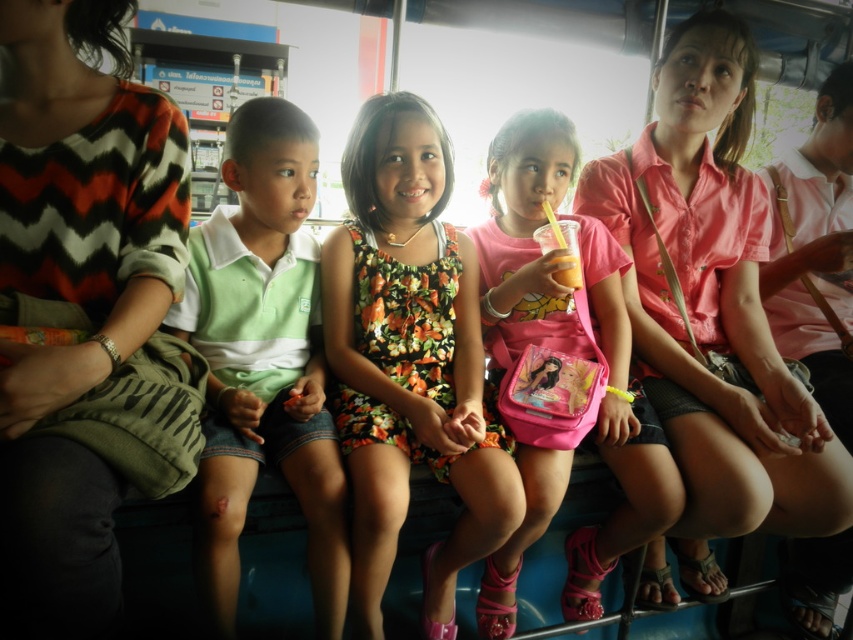
Is floral dress at center above green cotton shirt at left?

Yes, floral dress at center is above green cotton shirt at left.

Describe the element at coordinates (409, 358) in the screenshot. I see `floral dress at center` at that location.

Locate an element on the screen. floral dress at center is located at coordinates (409, 358).

Does floral dress at center have a larger size compared to pink fabric bag at center?

No.

Based on the photo, how far apart are floral dress at center and pink fabric bag at center?

floral dress at center is 20.57 centimeters away from pink fabric bag at center.

This screenshot has width=853, height=640. I want to click on floral dress at center, so click(x=409, y=358).

At what (x,y) coordinates should I click in order to perform the action: click on floral dress at center. Please return your answer as a coordinate pair (x, y). This screenshot has height=640, width=853. Looking at the image, I should click on (409, 358).

Can you confirm if green cotton shirt at left is shorter than pink fabric bag at center?

Yes, green cotton shirt at left is shorter than pink fabric bag at center.

Identify the location of green cotton shirt at left. The image size is (853, 640). (263, 356).

You are a GUI agent. You are given a task and a screenshot of the screen. Output one action in this format:
    pyautogui.click(x=<x>, y=<y>)
    Task: Click on the green cotton shirt at left
    Image resolution: width=853 pixels, height=640 pixels.
    Given the screenshot: What is the action you would take?
    pyautogui.click(x=263, y=356)